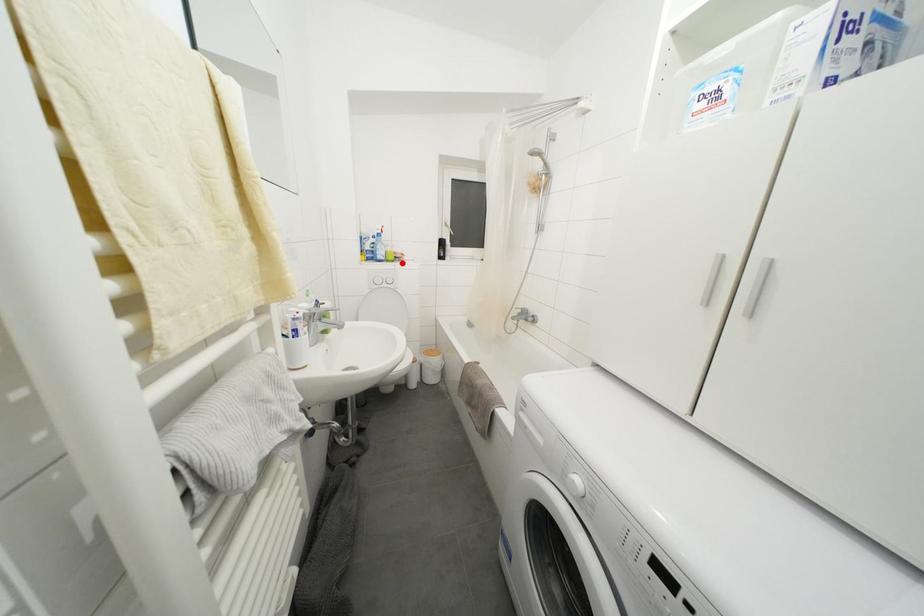
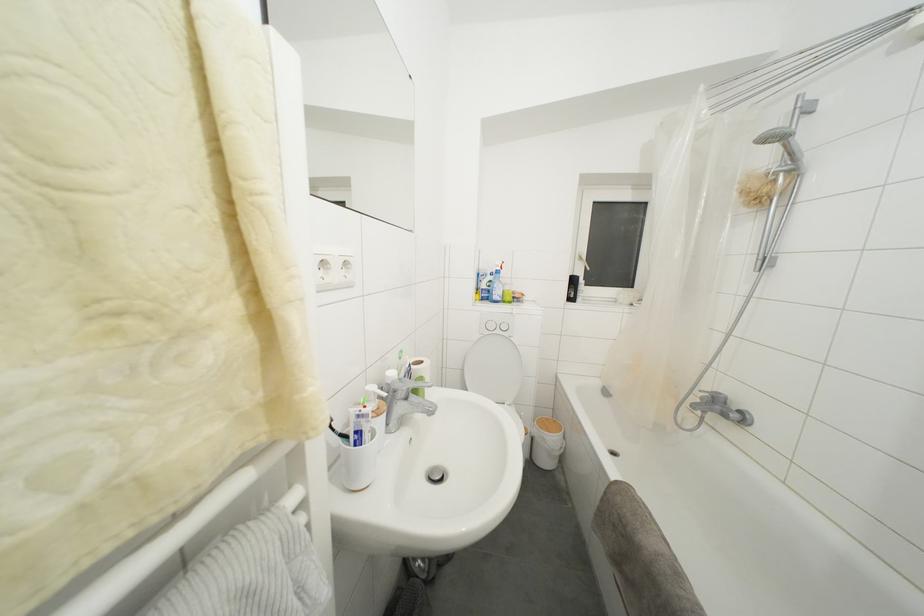
In the second image, find the point that corresponds to the highlighted location in the first image.

(520, 304)